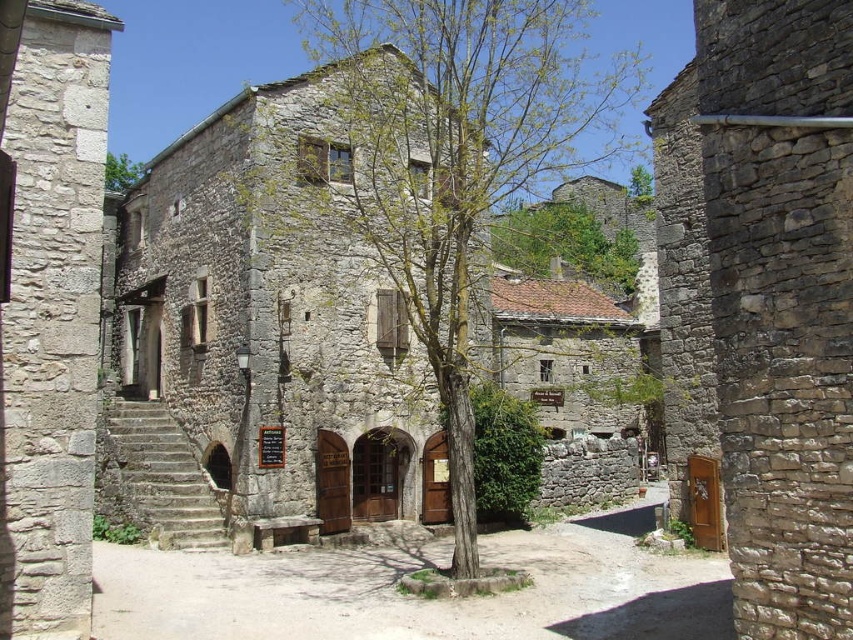
Question: Which of the following is the farthest from the observer?

Choices:
 (A) (595, 612)
 (B) (473, 490)
 (C) (132, 168)

Answer: (C)

Question: Does green leafy tree at center appear on the right side of dull stone alley at center?

Choices:
 (A) yes
 (B) no

Answer: (B)

Question: Which point is farther to the camera?

Choices:
 (A) coord(113,179)
 (B) coord(728,634)
 (C) coord(428,36)

Answer: (A)

Question: Is green leafy tree at center positioned in front of green leafy tree at upper center?

Choices:
 (A) no
 (B) yes

Answer: (A)

Question: Which point is closer to the camera?

Choices:
 (A) dull stone alley at center
 (B) green leafy tree at upper center
 (C) green leafy tree at center

Answer: (A)

Question: Does green leafy tree at center have a smaller size compared to green leafy tree at upper center?

Choices:
 (A) yes
 (B) no

Answer: (B)